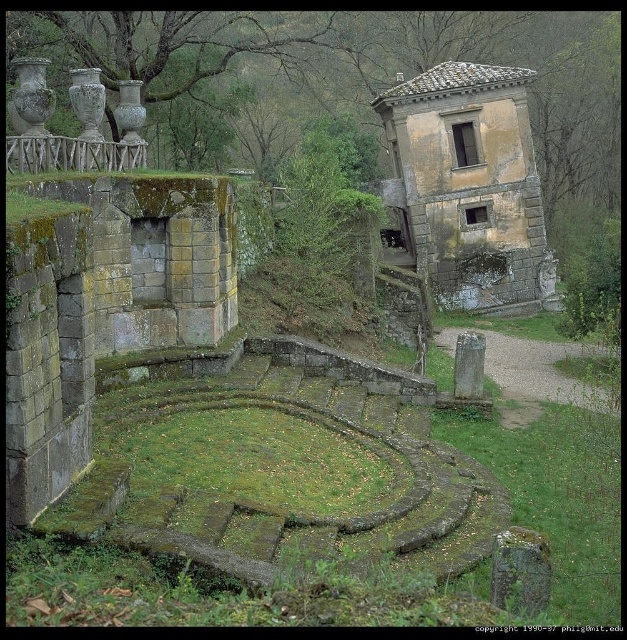
Is yellow stone amphitheater at center shorter than green mossy stone at center?

In fact, yellow stone amphitheater at center may be taller than green mossy stone at center.

The height and width of the screenshot is (640, 627). What are the coordinates of `yellow stone amphitheater at center` in the screenshot? It's located at (468, 184).